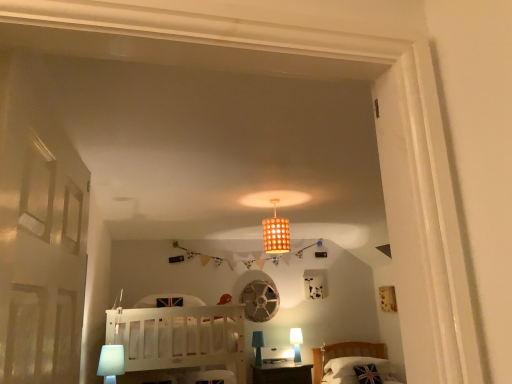
Question: From the image's perspective, is blue fabric table lamp at lower center, which is counted as the second table lamp, starting from the front, positioned above or below white plastic table lamp at lower left, which appears as the 1th table lamp when viewed from the top?

Choices:
 (A) below
 (B) above

Answer: (A)

Question: From their relative heights in the image, would you say blue fabric table lamp at lower center, which appears as the 2th table lamp when viewed from the back, is taller or shorter than white plastic table lamp at lower left, placed as the first table lamp when sorted from front to back?

Choices:
 (A) tall
 (B) short

Answer: (A)

Question: Which object is positioned farthest from the white glossy table lamp at lower right, marked as the 3th table lamp in a top-to-bottom arrangement?

Choices:
 (A) white wooden bunk bed at center
 (B) matte brown wooden table at center
 (C) white plastic table lamp at lower left, which appears as the 1th table lamp when viewed from the top
 (D) union jack fabric pillow at lower right
 (E) blue fabric table lamp at lower center, which is counted as the second table lamp, starting from the front

Answer: (C)

Question: Which object is the closest to the union jack fabric pillow at lower right?

Choices:
 (A) wooden lampshade at center
 (B) matte brown wooden table at center
 (C) white glossy table lamp at lower right, the first table lamp positioned from the back
 (D) white plastic table lamp at lower left, placed as the first table lamp when sorted from front to back
 (E) blue fabric table lamp at lower center, positioned as the second table lamp in bottom-to-top order

Answer: (B)